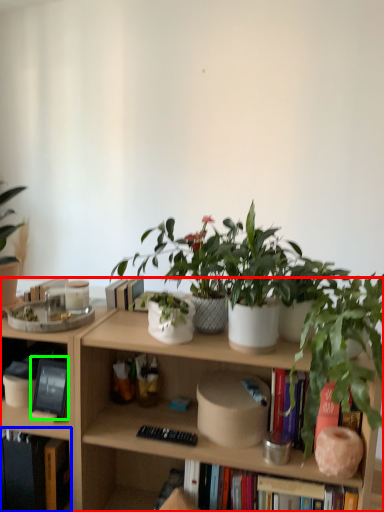
Question: Which object is positioned closest to bookcase (highlighted by a red box)? Select from book (highlighted by a blue box) and book (highlighted by a green box).

Choices:
 (A) book
 (B) book

Answer: (A)